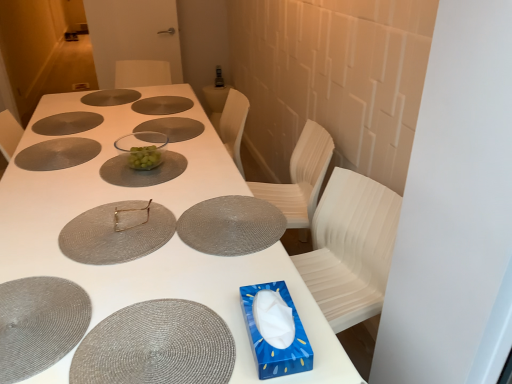
At what (x,y) coordinates should I click in order to perform the action: click on vacant space that is in between matte gray glass plate at upper left, which is counted as the 7th glass plate, starting from the front, and woven gray placemat at lower left. Please return your answer as a coordinate pair (x, y). Looking at the image, I should click on (50, 176).